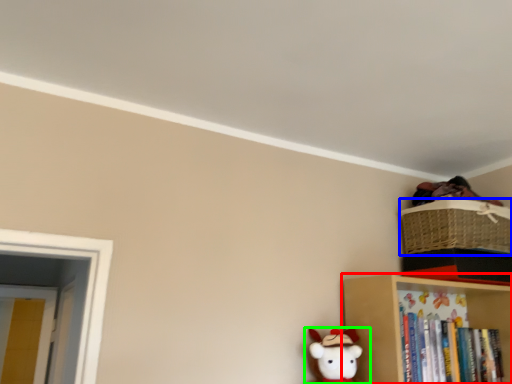
Question: Considering the real-world distances, which object is closest to shelf (highlighted by a red box)? basket (highlighted by a blue box) or toy (highlighted by a green box).

Choices:
 (A) basket
 (B) toy

Answer: (B)